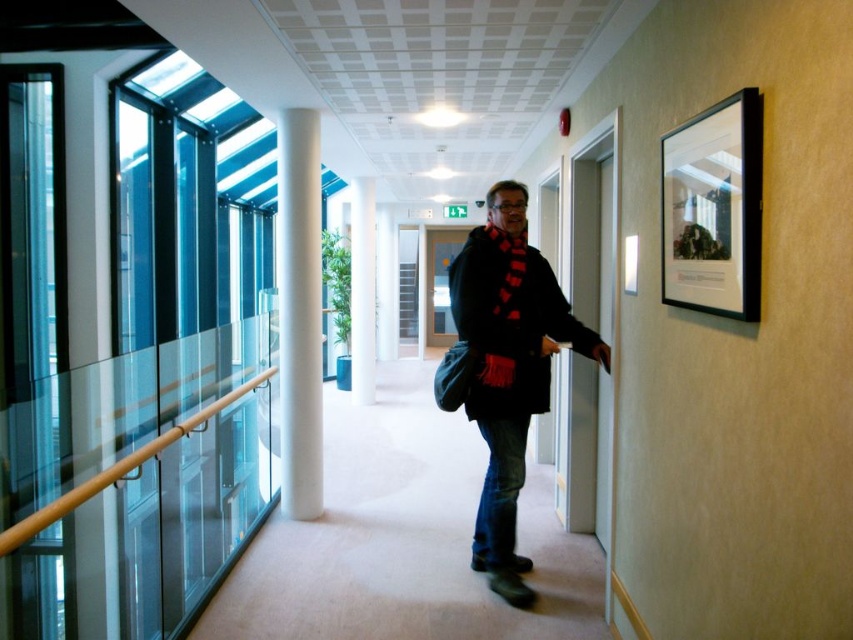
You are standing in the hallway and want to hang a small hook on the wall between the black matte coat at center and the white smooth column at center. Which object should you place the hook closer to if you want it to be on the right side of the column?

The black matte coat at center is to the right of the white smooth column at center, so placing the hook closer to the black matte coat at center would position it on the right side of the column.

You are standing in the hallway and need to reach a door located at point (299, 312). Is there an obstacle in your path towards that point?

The white smooth column at center is located at point (299, 312), so the column is exactly at the point where the door is located. Therefore, the column would block your path to the door.